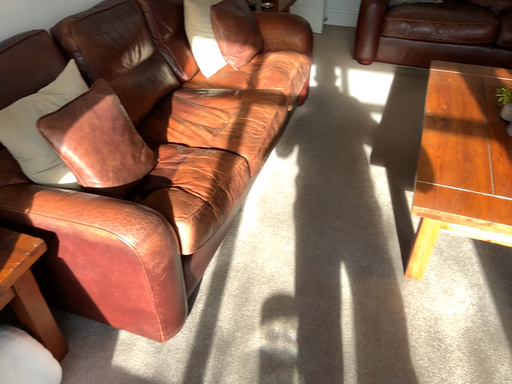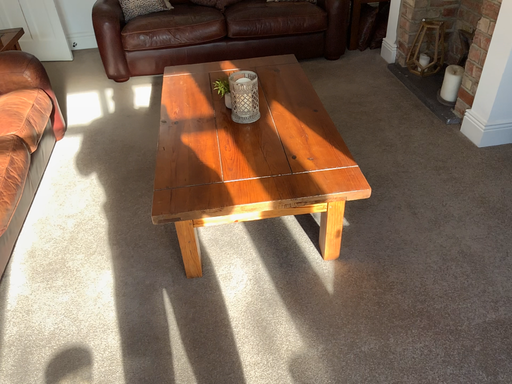
Question: Which way did the camera rotate in the video?

Choices:
 (A) rotated right
 (B) rotated left

Answer: (A)